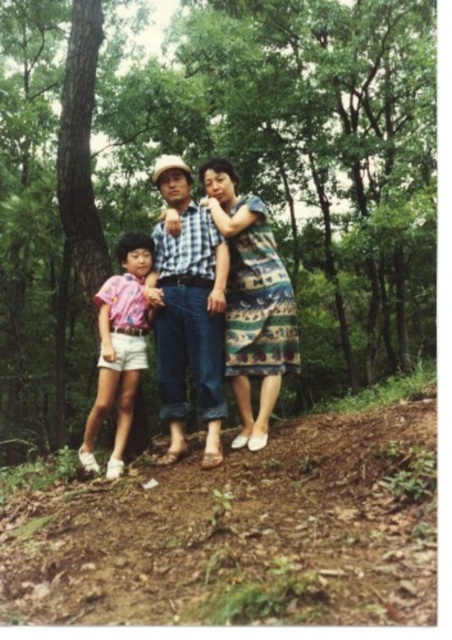
Question: Can you confirm if green leafy trees at center is positioned to the right of patterned fabric dress at center?

Choices:
 (A) yes
 (B) no

Answer: (B)

Question: Does dirt ground at lower center have a smaller size compared to patterned fabric dress at center?

Choices:
 (A) no
 (B) yes

Answer: (A)

Question: Which point is farther from the camera taking this photo?

Choices:
 (A) (240, 236)
 (B) (365, 536)

Answer: (A)

Question: Which object appears closest to the camera in this image?

Choices:
 (A) green leafy trees at center
 (B) pink cotton shorts at lower left

Answer: (B)

Question: Does matte blue jeans at center have a lesser width compared to patterned fabric dress at center?

Choices:
 (A) yes
 (B) no

Answer: (B)

Question: Which point is closer to the camera?

Choices:
 (A) (211, 332)
 (B) (122, 372)

Answer: (A)